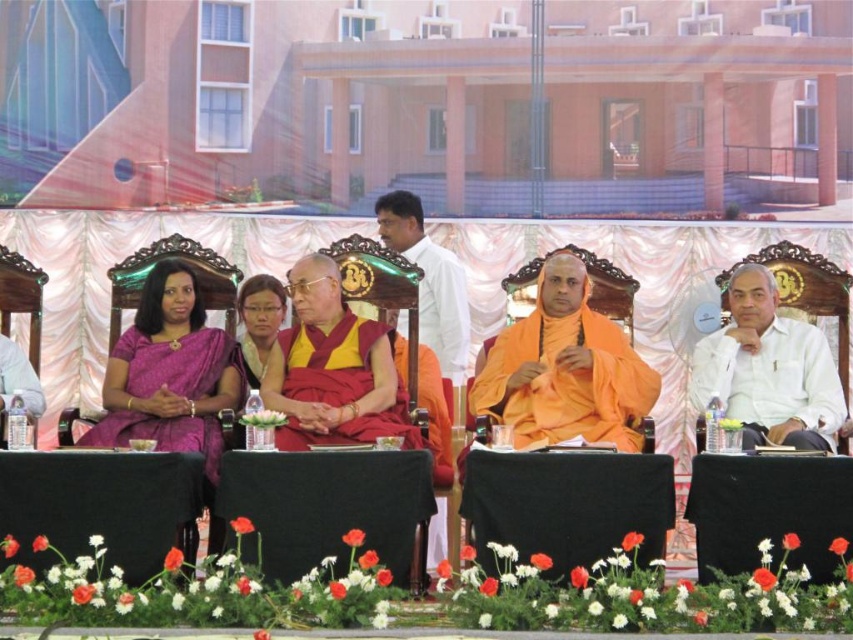
Who is taller, white cotton shirt at right or yellow silk robe at center?

white cotton shirt at right is taller.

Between point (824, 440) and point (286, 376), which one is positioned behind?

Positioned behind is point (286, 376).

Between point (819, 401) and point (346, 397), which one is positioned in front?

Point (346, 397) is more forward.

In order to click on white cotton shirt at right in this screenshot , I will do `click(769, 369)`.

Based on the photo, does orange silk robe at center have a lesser width compared to white cotton shirt at right?

No, orange silk robe at center is not thinner than white cotton shirt at right.

Which of these two, orange silk robe at center or white cotton shirt at right, stands taller?

With more height is orange silk robe at center.

Between point (587, 307) and point (730, 278), which one is positioned behind?

The point (730, 278) is behind.

Image resolution: width=853 pixels, height=640 pixels. I want to click on orange silk robe at center, so click(566, 369).

Which is below, yellow silk robe at center or white silk robe at center?

yellow silk robe at center is lower down.

Does yellow silk robe at center have a lesser height compared to white silk robe at center?

Correct, yellow silk robe at center is not as tall as white silk robe at center.

The width and height of the screenshot is (853, 640). What do you see at coordinates (329, 362) in the screenshot? I see `yellow silk robe at center` at bounding box center [329, 362].

Where is `yellow silk robe at center`? yellow silk robe at center is located at coordinates (329, 362).